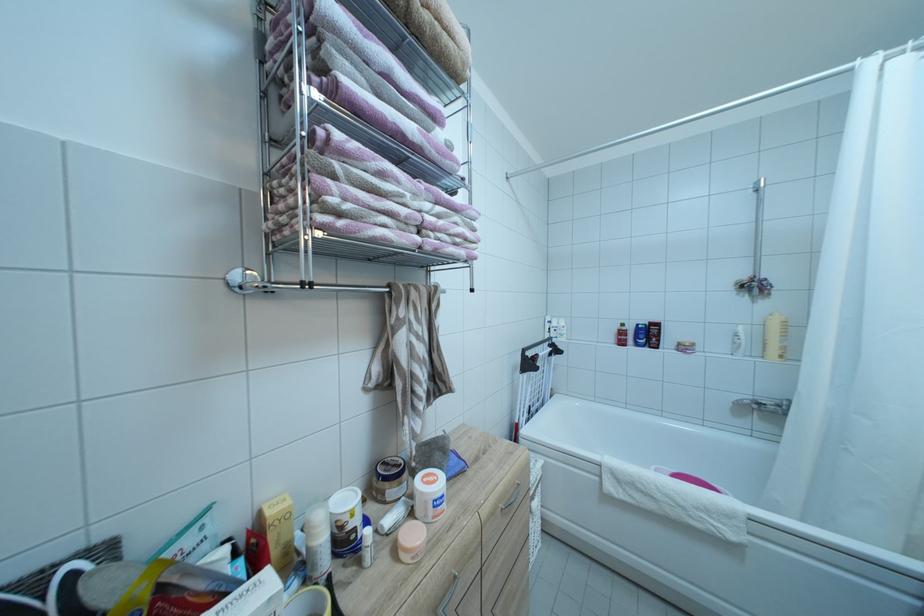
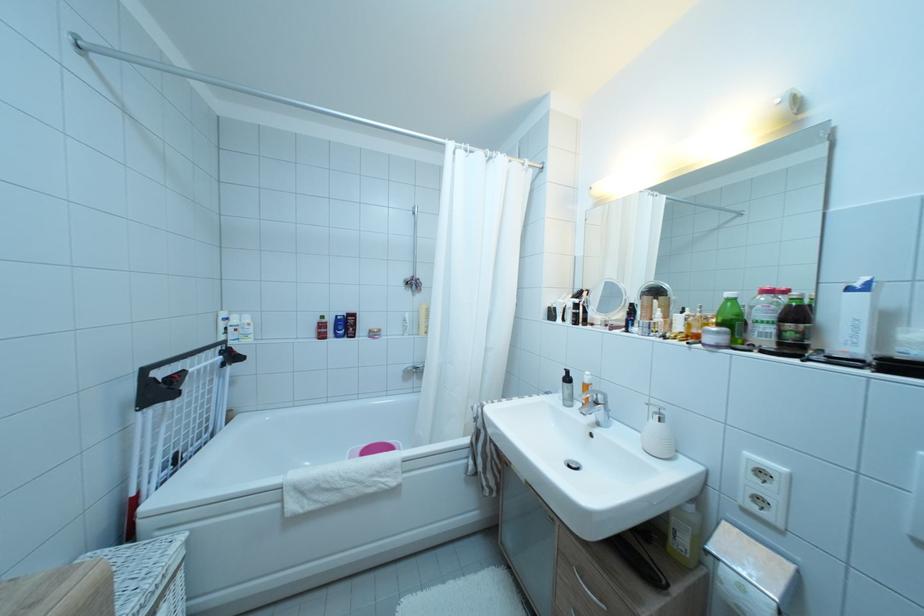
The point at (625,331) is marked in the first image. Where is the corresponding point in the second image?

(324, 325)